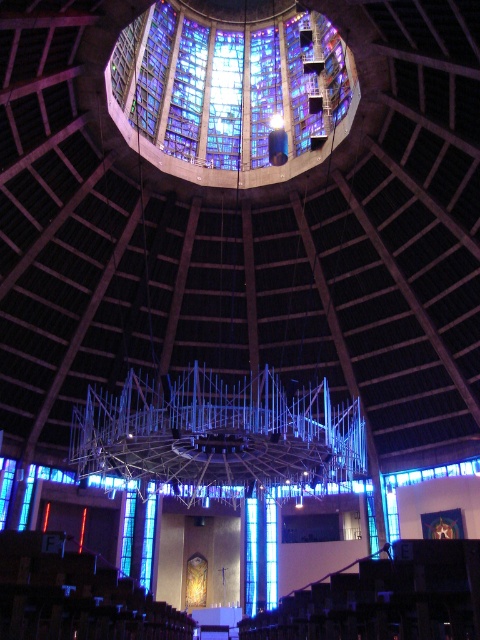
Between stained glass at center and blue glass window at center, which one appears on the right side from the viewer's perspective?

stained glass at center

At what (x,y) coordinates should I click in order to perform the action: click on stained glass at center. Please return your answer as a coordinate pair (x, y). This screenshot has height=640, width=480. Looking at the image, I should click on (230, 83).

Find the location of `stained glass at center`. stained glass at center is located at coordinates (230, 83).

Who is positioned more to the right, transparent glass window at center or blue glass window at center?

transparent glass window at center is more to the right.

The height and width of the screenshot is (640, 480). What do you see at coordinates (271, 554) in the screenshot?
I see `transparent glass window at center` at bounding box center [271, 554].

Locate an element on the screen. transparent glass window at center is located at coordinates (271, 554).

Who is taller, stained glass at center or transparent glass window at center?

With more height is stained glass at center.

Can you confirm if stained glass at center is positioned to the left of transparent glass window at center?

Indeed, stained glass at center is positioned on the left side of transparent glass window at center.

Is point (300, 83) positioned before point (268, 513)?

Yes, it is in front of point (268, 513).

Locate an element on the screen. Image resolution: width=480 pixels, height=640 pixels. stained glass at center is located at coordinates (230, 83).